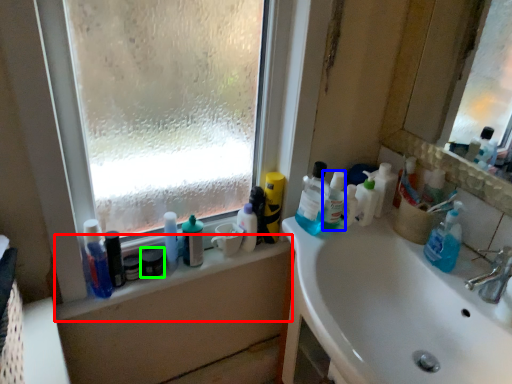
Question: Which object is positioned closest to window sill (highlighted by a red box)? Select from toiletry (highlighted by a blue box) and mouthwash (highlighted by a green box).

Choices:
 (A) toiletry
 (B) mouthwash

Answer: (B)